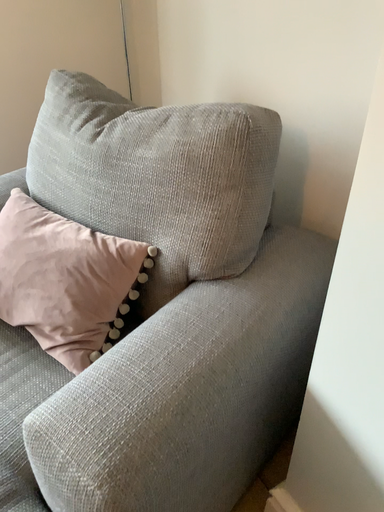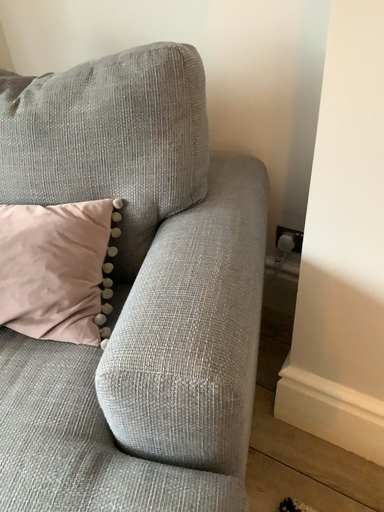
Question: How did the camera likely rotate when shooting the video?

Choices:
 (A) rotated right
 (B) rotated left

Answer: (A)